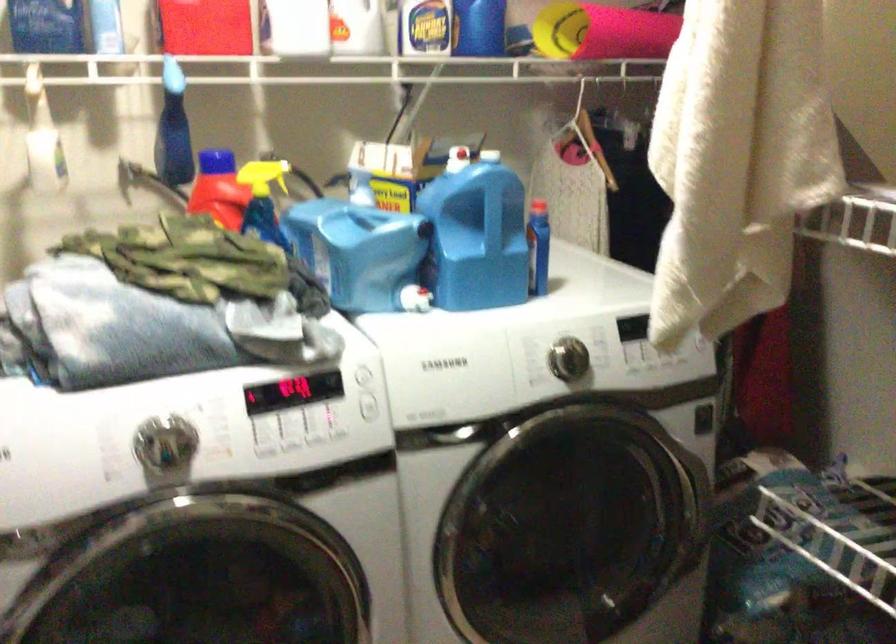
Describe the element at coordinates (737, 160) in the screenshot. I see `the rolled pink mat` at that location.